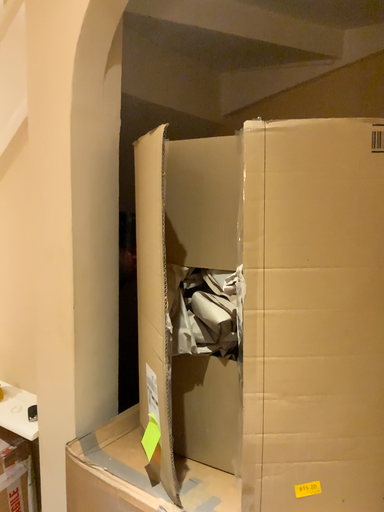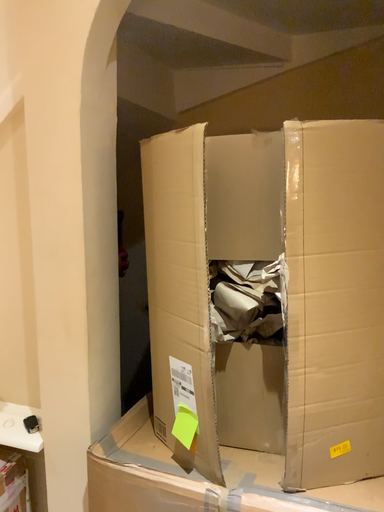
Question: How did the camera likely rotate when shooting the video?

Choices:
 (A) rotated left
 (B) rotated right

Answer: (B)